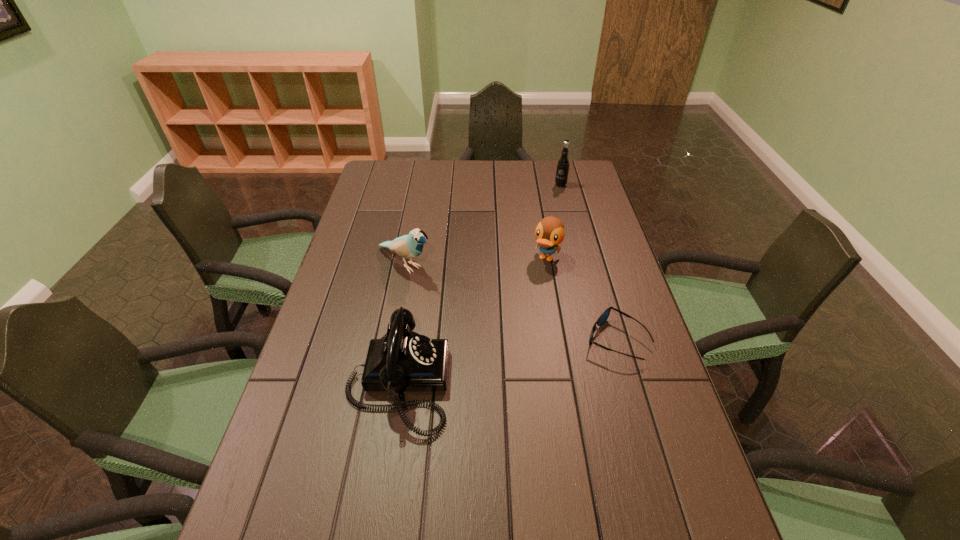
Where is `vacant region located 0.230m at the face of the bird`? The image size is (960, 540). vacant region located 0.230m at the face of the bird is located at coordinates (480, 312).

Identify the location of free space located 0.340m at the face of the bird. (510, 331).

Where is `free spot located on the front-facing side of the duck`? This screenshot has width=960, height=540. free spot located on the front-facing side of the duck is located at coordinates (507, 335).

Locate an element on the screen. vacant area situated 0.280m on the front-facing side of the duck is located at coordinates (510, 330).

At what (x,y) coordinates should I click in order to perform the action: click on free location located on the front-facing side of the duck. Please return your answer as a coordinate pair (x, y). The width and height of the screenshot is (960, 540). Looking at the image, I should click on (492, 363).

This screenshot has width=960, height=540. Identify the location of vacant space located on the label of the farthest object. (547, 227).

The image size is (960, 540). In order to click on free location located on the label of the farthest object in this screenshot , I will do `click(552, 213)`.

This screenshot has width=960, height=540. Identify the location of vacant area situated 0.090m on the label of the farthest object. (x=556, y=200).

Identify the location of object positioned at the far edge. Image resolution: width=960 pixels, height=540 pixels. (563, 163).

At what (x,y) coordinates should I click in order to perform the action: click on telephone located in the left edge section of the desktop. Please return your answer as a coordinate pair (x, y). The width and height of the screenshot is (960, 540). Looking at the image, I should click on (402, 360).